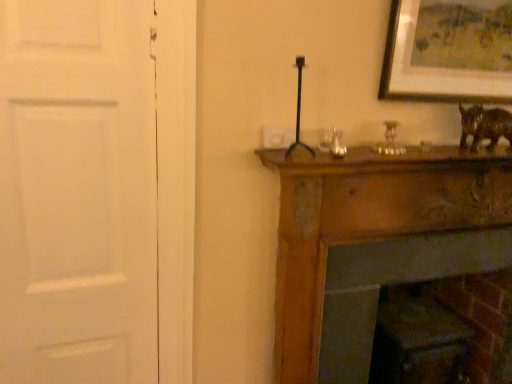
At what (x,y) coordinates should I click in order to perform the action: click on blank space situated above wooden fireplace at center (from a real-world perspective). Please return your answer as a coordinate pair (x, y). Looking at the image, I should click on [419, 175].